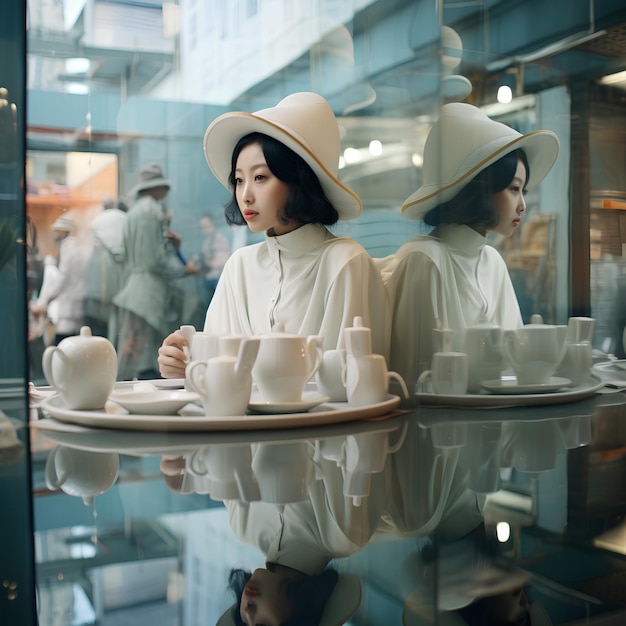
This screenshot has height=626, width=626. I want to click on plates, so click(x=165, y=404), click(x=278, y=408).